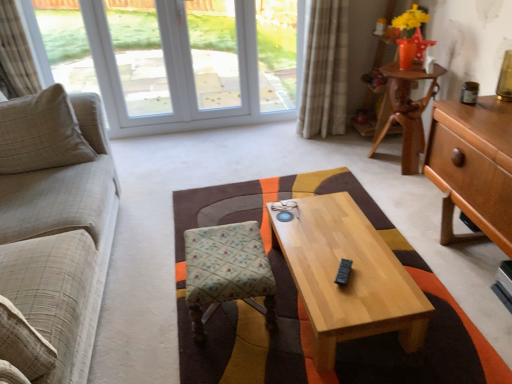
The height and width of the screenshot is (384, 512). Identify the location of vacant space in front of matte brown jar at upper right. (485, 110).